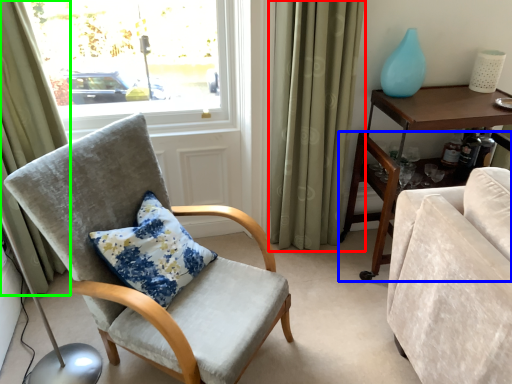
Question: Considering the real-world distances, which object is closest to curtain (highlighted by a red box)? desk (highlighted by a blue box) or curtain (highlighted by a green box).

Choices:
 (A) desk
 (B) curtain

Answer: (A)